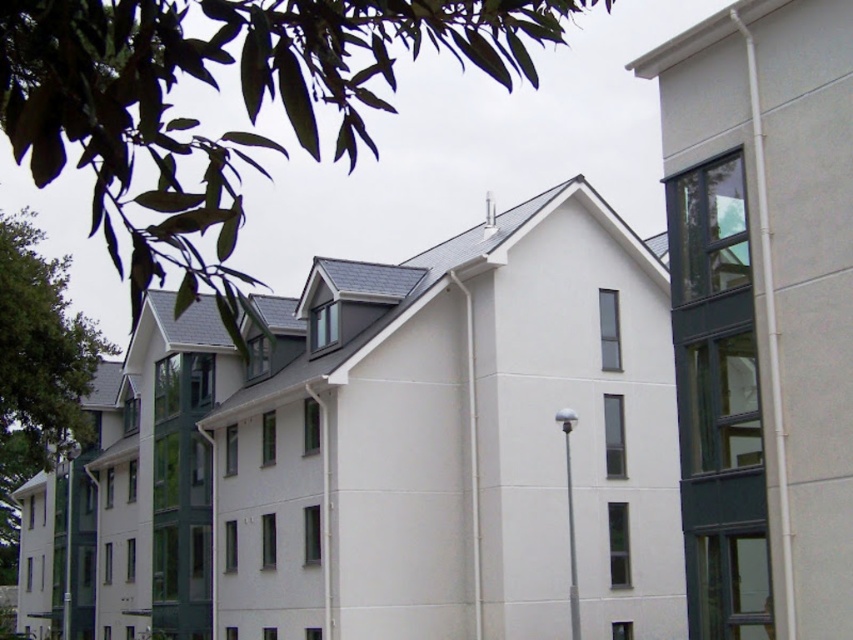
Between green leafy tree at upper left and green leafy tree at left, which one has less height?

Standing shorter between the two is green leafy tree at left.

From the picture: Between green leafy tree at upper left and green leafy tree at left, which one is positioned higher?

Positioned higher is green leafy tree at upper left.

You are a GUI agent. You are given a task and a screenshot of the screen. Output one action in this format:
    pyautogui.click(x=<x>, y=<y>)
    Task: Click on the green leafy tree at upper left
    
    Given the screenshot: What is the action you would take?
    pyautogui.click(x=218, y=90)